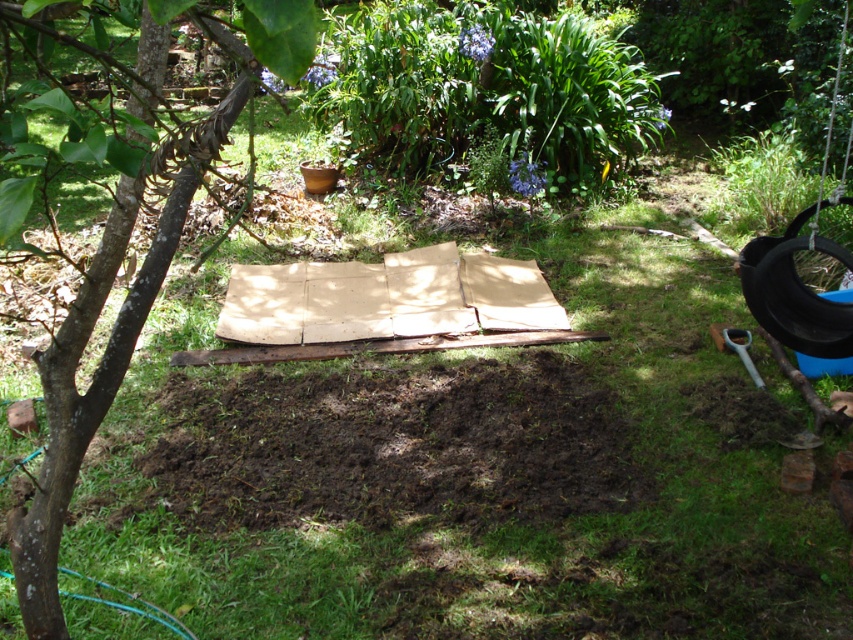
You are a gardener planning to place a new garden bench between the brown rough tree at left and the black rubber tire at right. Considering their sizes, which object should you position closer to the bench to ensure stability?

The brown rough tree at left is larger in size than the black rubber tire at right, so positioning the bench closer to the brown rough tree at left would provide better stability due to its larger base.

You are a gardener planning to place a new black rubber tire at right near the brown rough tree at left. Considering their widths, which object would require more space horizontally if placed side by side?

Result: The brown rough tree at left might be wider than the black rubber tire at right, so it would require more horizontal space when placed side by side.

You are a gardener standing in the garden. You want to plant a new flower bed between the brown rough tree at left and the black rubber tire at right. Which object will you have to move first to create space?

The brown rough tree at left is in front of the black rubber tire at right, so you would need to move the brown rough tree at left first to create space for the flower bed.